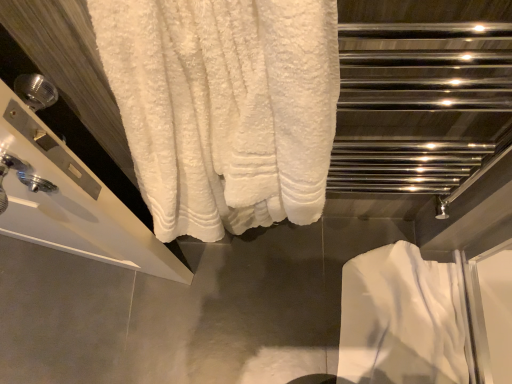
This screenshot has width=512, height=384. In order to click on vacant area situated to the left side of white soft towel at lower right in this screenshot , I will do tap(271, 304).